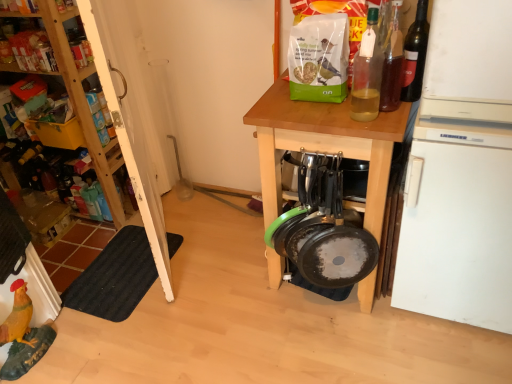
The width and height of the screenshot is (512, 384). What are the coordinates of `free space behind translucent glass bottle at upper right, the 1th bottle viewed from the left` in the screenshot? It's located at (351, 107).